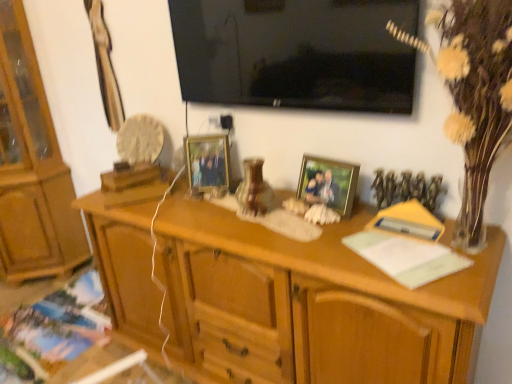
This screenshot has width=512, height=384. I want to click on vacant area that lies in front of light brown wood cabinet at left, so click(37, 312).